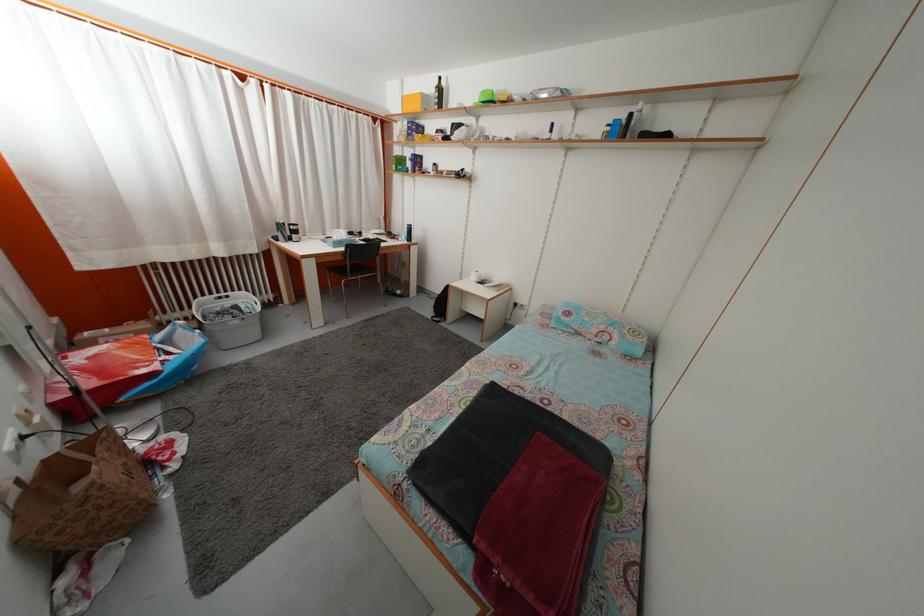
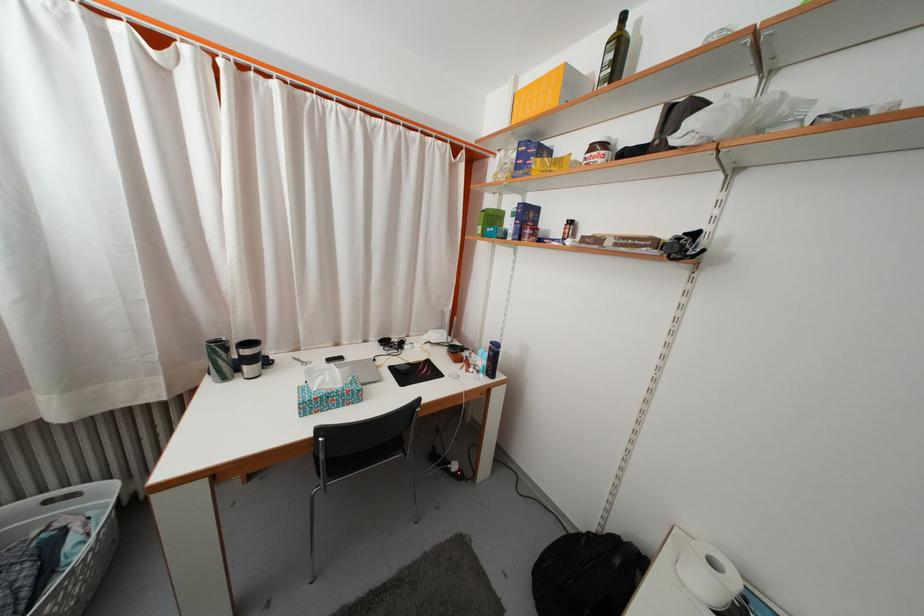
Question: In a continuous first-person perspective shot, in which direction is the camera moving?

Choices:
 (A) Left
 (B) Right
 (C) Forward
 (D) Backward

Answer: (C)